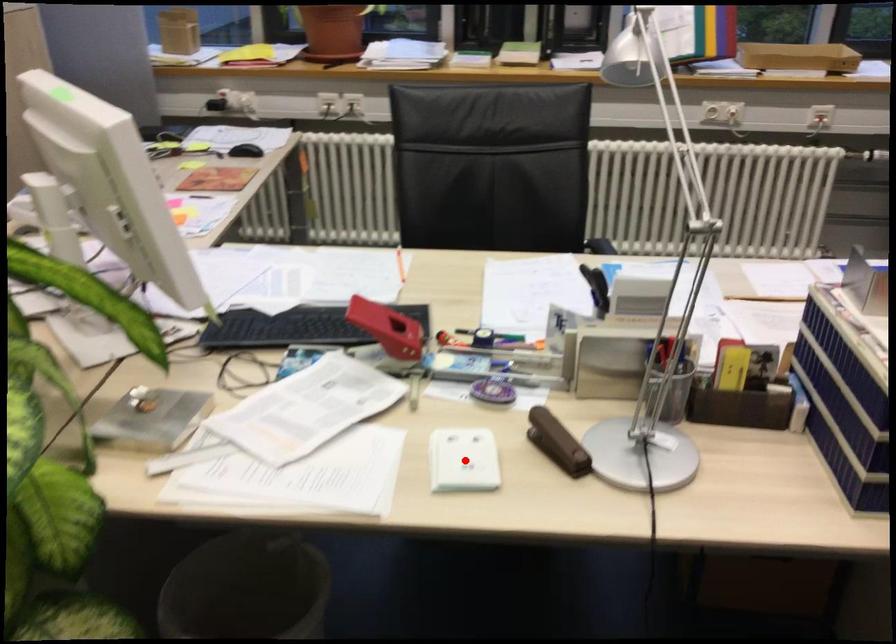
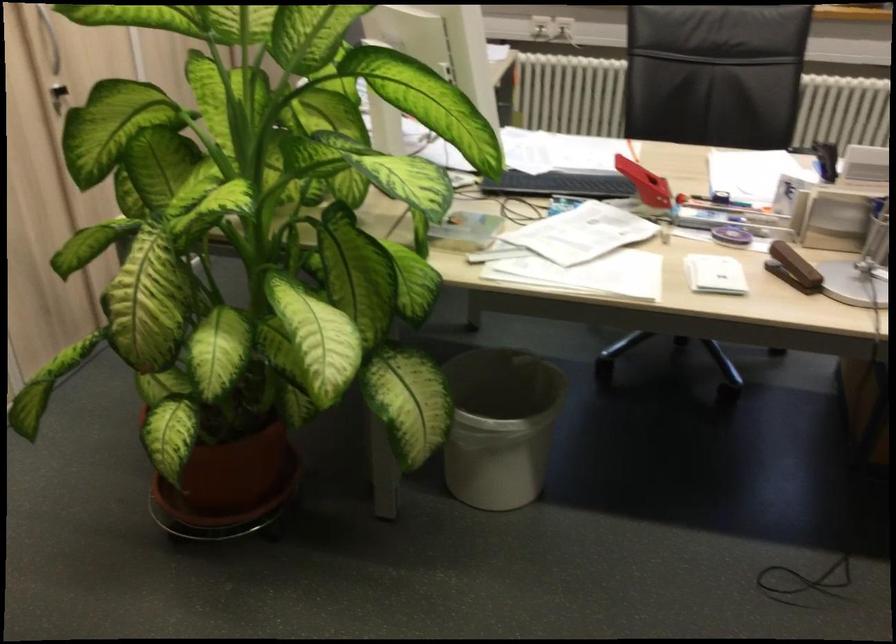
Question: I am providing you with two images of the same scene from different viewpoints. In image1, a red point is highlighted. Considering the same 3D point in image2, which of the following is correct?

Choices:
 (A) It is closer
 (B) It is farther

Answer: (B)